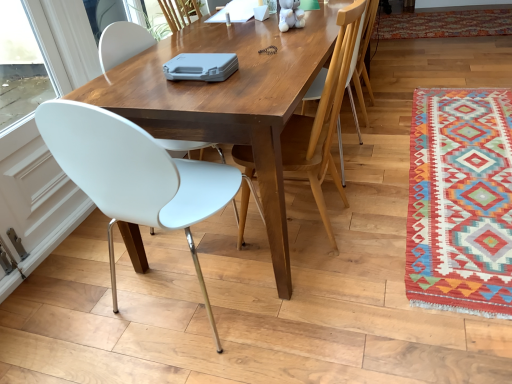
Where is `vacant region in front of white plastic chair at left, which is the 3th chair in right-to-left order`? Image resolution: width=512 pixels, height=384 pixels. vacant region in front of white plastic chair at left, which is the 3th chair in right-to-left order is located at coordinates click(x=194, y=359).